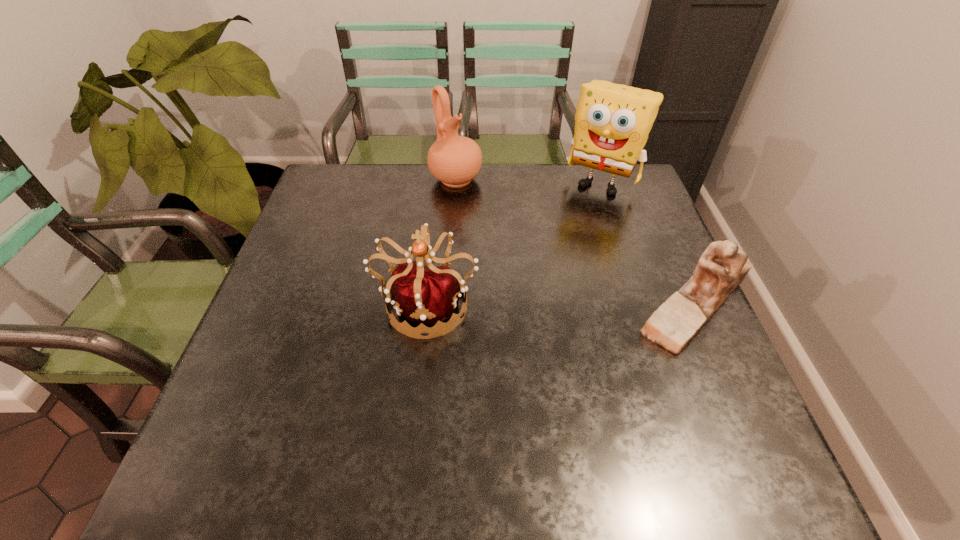
I want to click on the third tallest object, so click(x=427, y=294).

Locate an element on the screen. the shortest object is located at coordinates (723, 266).

Where is `sponge`? Image resolution: width=960 pixels, height=540 pixels. sponge is located at coordinates (612, 122).

I want to click on pottery, so click(455, 160).

The image size is (960, 540). What are the coordinates of `blank area located on the front-facing side of the tiara` in the screenshot? It's located at coord(419,384).

This screenshot has height=540, width=960. I want to click on free location located 0.080m on the front-facing side of the figurine, so 597,304.

Where is `free spot located on the front-facing side of the figurine`? This screenshot has height=540, width=960. free spot located on the front-facing side of the figurine is located at coordinates coord(588,304).

Locate an element on the screen. This screenshot has height=540, width=960. vacant space located on the front-facing side of the figurine is located at coordinates (602, 304).

This screenshot has height=540, width=960. What are the coordinates of `free space located 0.380m on the face of the sponge` in the screenshot? It's located at (539, 280).

Locate an element on the screen. The image size is (960, 540). free space located on the face of the sponge is located at coordinates (568, 232).